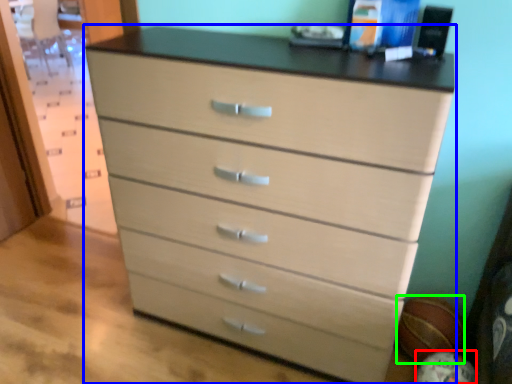
Question: Estimate the real-world distances between objects in this image. Which object is closer to basketball (highlighted by a red box), chest of drawers (highlighted by a blue box) or basketball (highlighted by a green box)?

Choices:
 (A) chest of drawers
 (B) basketball

Answer: (B)